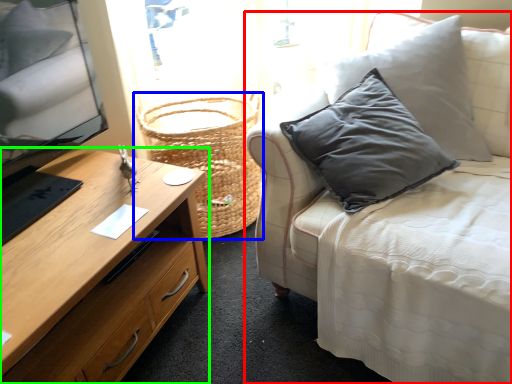
Question: Which is farther away from studio couch (highlighted by a red box)? basket (highlighted by a blue box) or desk (highlighted by a green box)?

Choices:
 (A) basket
 (B) desk

Answer: (A)